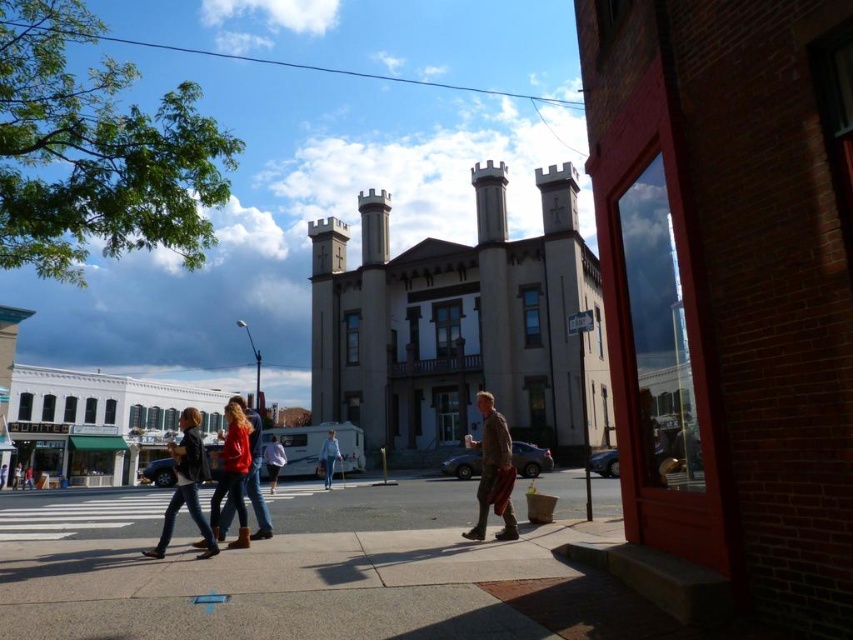
Can you confirm if red matte jacket at center is shorter than denim pants at center?

No.

Does red matte jacket at center appear on the left side of denim pants at center?

Incorrect, red matte jacket at center is not on the left side of denim pants at center.

Does point (252, 426) come in front of point (32, 481)?

Yes, it is in front of point (32, 481).

Identify the location of red matte jacket at center. The width and height of the screenshot is (853, 640). tap(254, 472).

Is leather jacket at center positioned before red matte jacket at center?

Yes, it is in front of red matte jacket at center.

The width and height of the screenshot is (853, 640). Find the location of `leather jacket at center`. leather jacket at center is located at coordinates (202, 480).

Which is in front, point (173, 513) or point (257, 493)?

Positioned in front is point (173, 513).

The width and height of the screenshot is (853, 640). I want to click on leather jacket at center, so click(202, 480).

Can you confirm if gray concrete sidewalk at lower center is positioned above red cotton jacket at center?

No.

You are a GUI agent. You are given a task and a screenshot of the screen. Output one action in this format:
    pyautogui.click(x=<x>, y=<y>)
    Task: Click on the gray concrete sidewalk at lower center
    The height and width of the screenshot is (640, 853).
    Given the screenshot: What is the action you would take?
    pyautogui.click(x=280, y=570)

Locate an element on the screen. gray concrete sidewalk at lower center is located at coordinates (280, 570).

Where is `gray concrete sidewalk at lower center`? The width and height of the screenshot is (853, 640). gray concrete sidewalk at lower center is located at coordinates (280, 570).